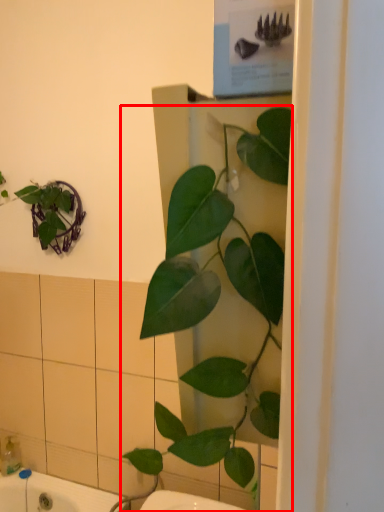
Question: Considering the relative positions of houseplant (annotated by the red box) and soap dispenser in the image provided, where is houseplant (annotated by the red box) located with respect to the staircase?

Choices:
 (A) right
 (B) left

Answer: (A)